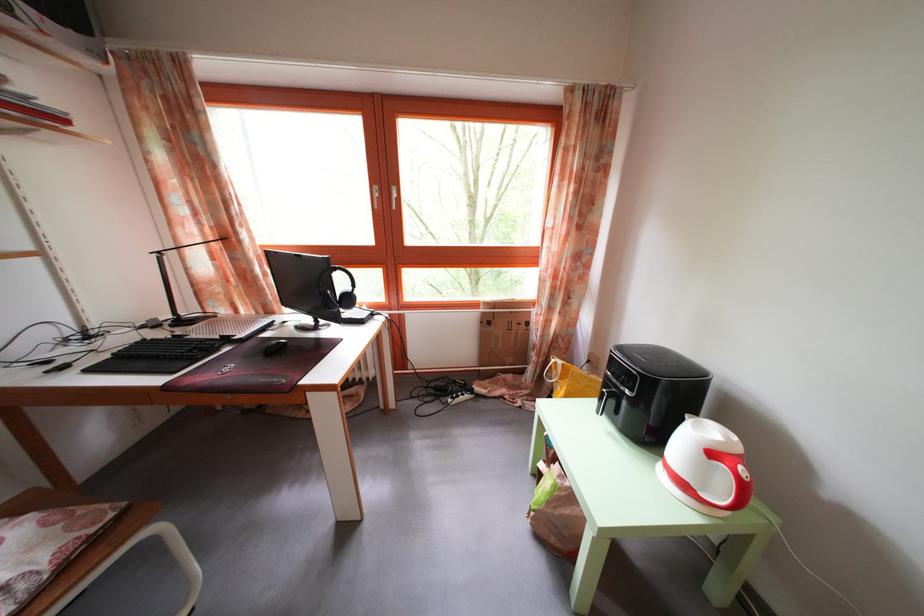
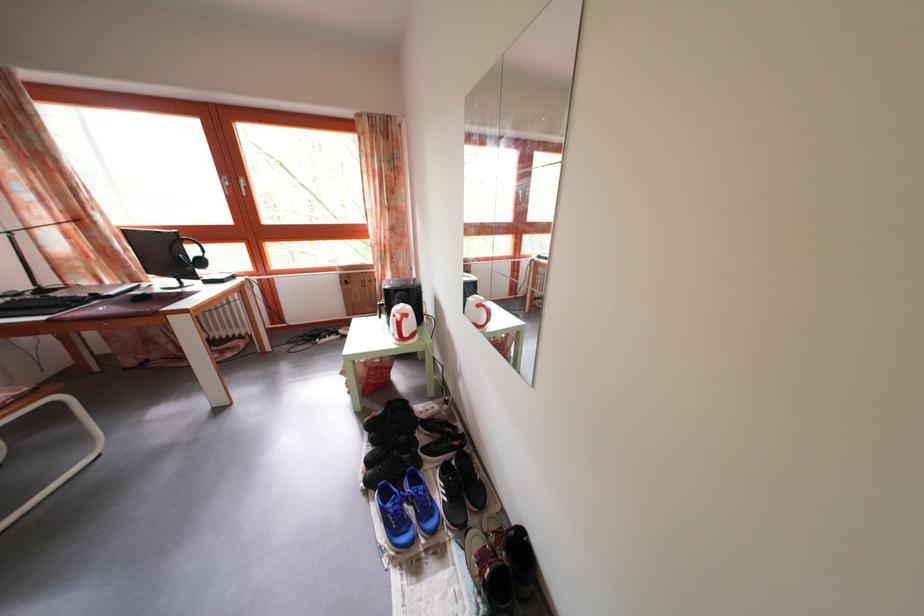
Which direction would the cameraman need to move to produce the second image?

The cameraman walked toward right, backward.